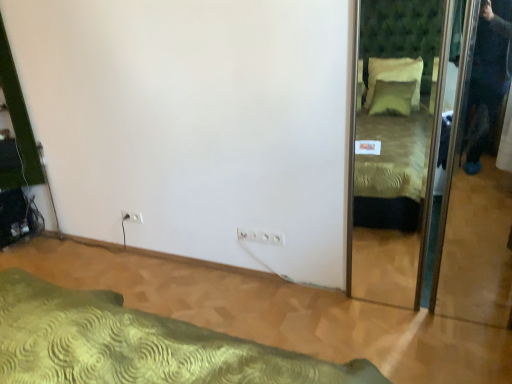
The height and width of the screenshot is (384, 512). Find the location of `blank space to the left of green textured mirror at right`. blank space to the left of green textured mirror at right is located at coordinates (341, 324).